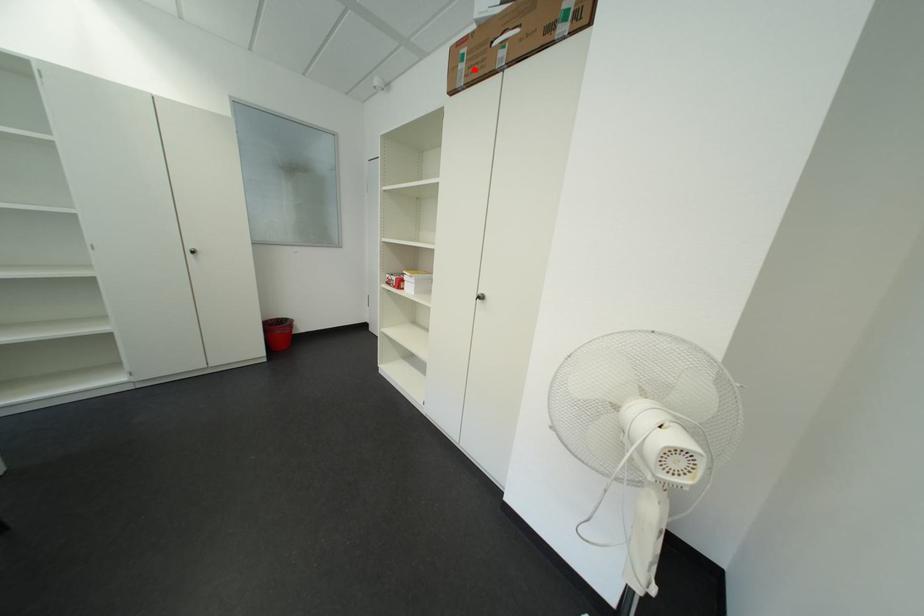
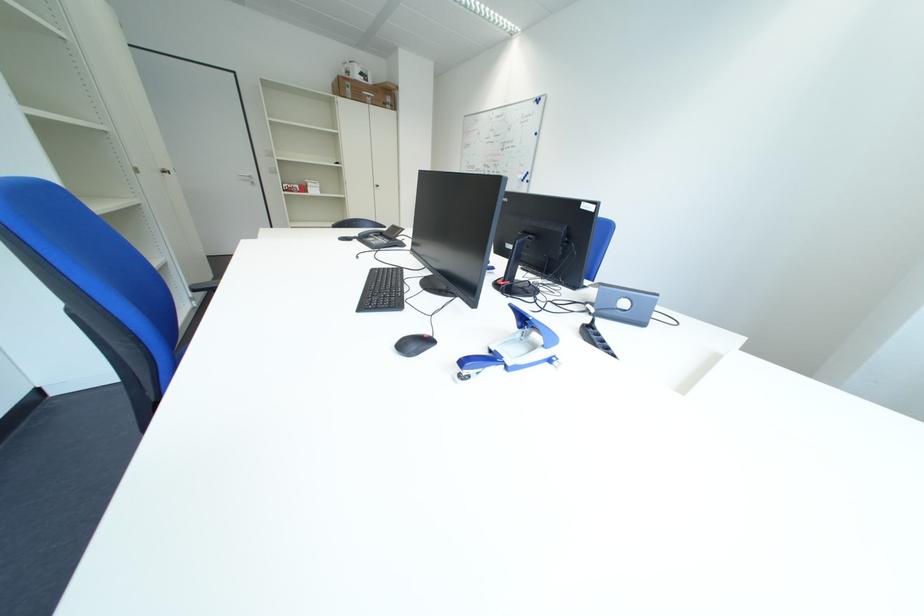
The point at the highlighted location is marked in the first image. Where is the corresponding point in the second image?

(360, 92)